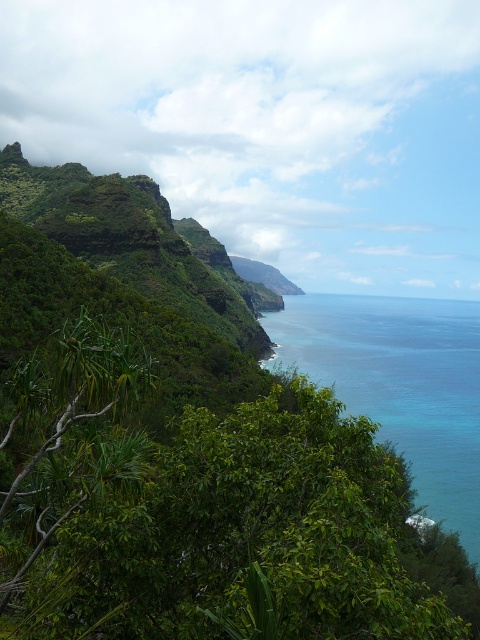
Who is more distant from viewer, (444,554) or (364,387)?

The point (364,387) is behind.

Where is `green leafy foliage at lower left`? This screenshot has width=480, height=640. green leafy foliage at lower left is located at coordinates (402, 384).